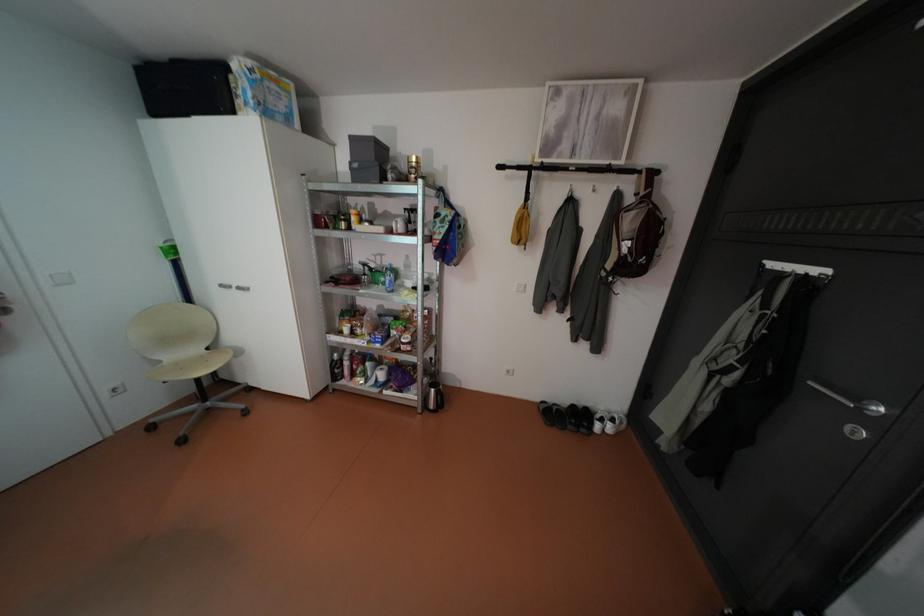
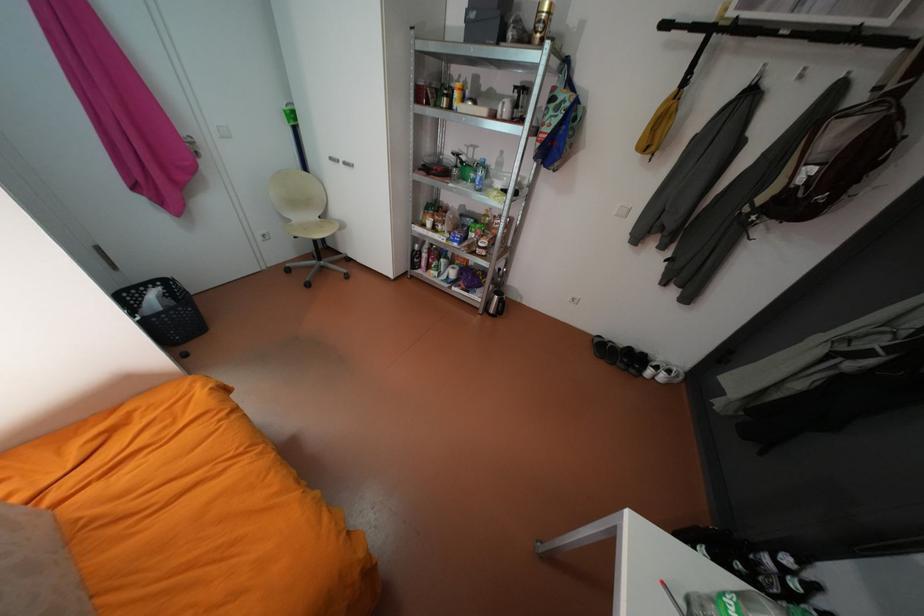
Where in the second image is the point corresponding to [411,177] from the first image?

(533, 39)